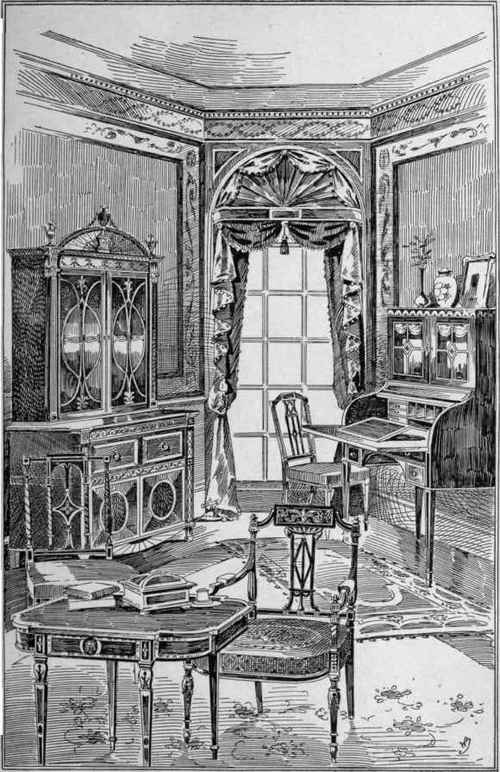
The height and width of the screenshot is (772, 500). Identify the location of ceiling. (252, 45).